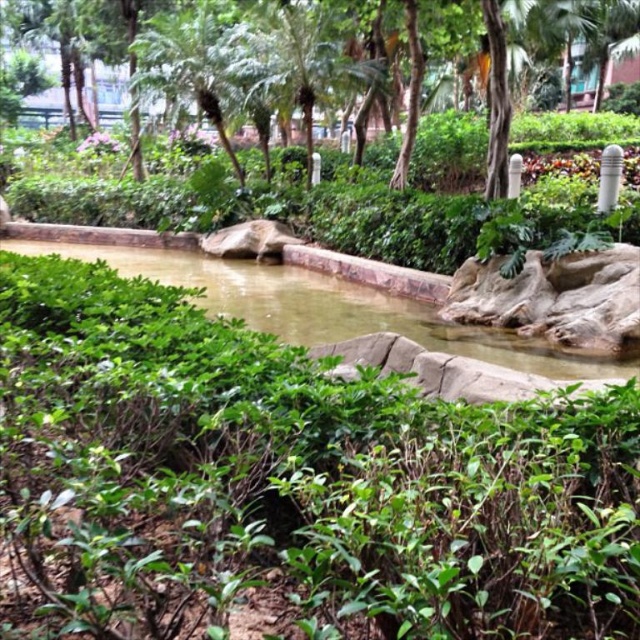
Question: Can you confirm if green leafy tree at upper center is positioned above greenish-brown water at center?

Choices:
 (A) yes
 (B) no

Answer: (A)

Question: Where is green leafy tree at upper center located in relation to greenish-brown water at center in the image?

Choices:
 (A) above
 (B) below

Answer: (A)

Question: Which point is farther from the camera taking this photo?

Choices:
 (A) (362, 67)
 (B) (156, 262)

Answer: (A)

Question: Where is green leafy tree at upper center located in relation to greenish-brown water at center in the image?

Choices:
 (A) above
 (B) below

Answer: (A)

Question: Which of the following is the farthest from the observer?

Choices:
 (A) greenish-brown water at center
 (B) green leafy tree at upper center

Answer: (B)